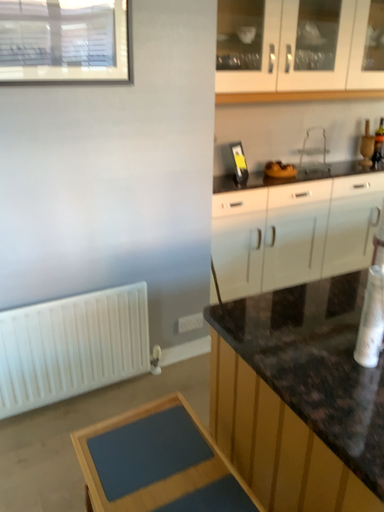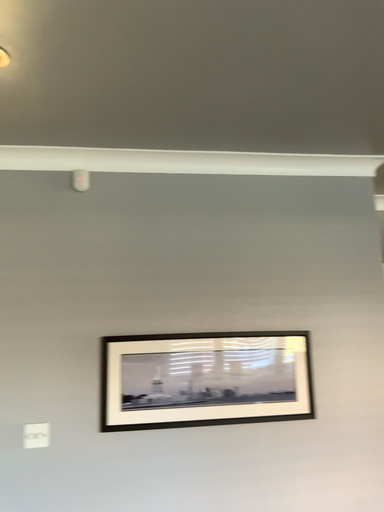
Question: How did the camera likely rotate when shooting the video?

Choices:
 (A) rotated downward
 (B) rotated upward

Answer: (B)